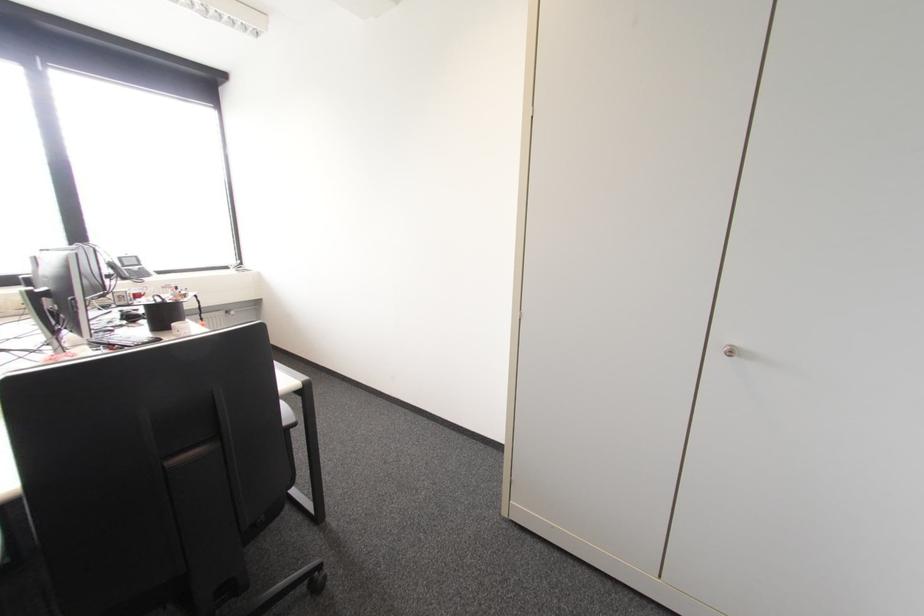
What do you see at coordinates (117, 270) in the screenshot?
I see `the telephone handset` at bounding box center [117, 270].